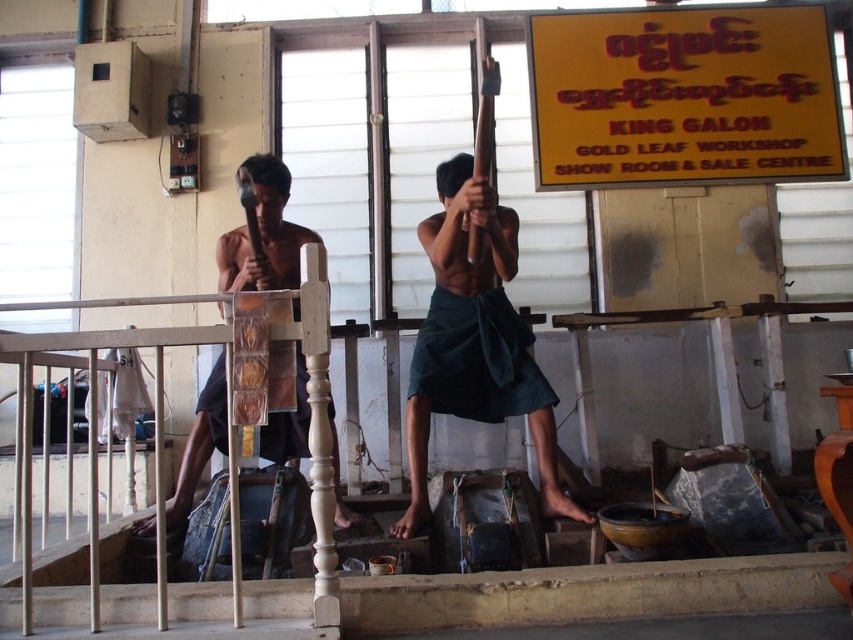
Question: Considering the relative positions of yellow paper sign at upper right and white wooden railing at center in the image provided, where is yellow paper sign at upper right located with respect to white wooden railing at center?

Choices:
 (A) below
 (B) above

Answer: (B)

Question: Which object is the farthest from the white wooden railing at center?

Choices:
 (A) green fabric at center
 (B) dark green fabric at center
 (C) yellow paper sign at upper right

Answer: (C)

Question: Is green fabric at center smaller than white wooden railing at center?

Choices:
 (A) yes
 (B) no

Answer: (A)

Question: Which point is farther to the camera?

Choices:
 (A) (289, 262)
 (B) (318, 612)
 (C) (735, 86)
 (D) (503, 328)

Answer: (C)

Question: Which point is farther to the camera?

Choices:
 (A) (236, 266)
 (B) (163, 595)
 (C) (718, 28)

Answer: (C)

Question: Is the position of white wooden railing at center more distant than that of dark green fabric at center?

Choices:
 (A) yes
 (B) no

Answer: (B)